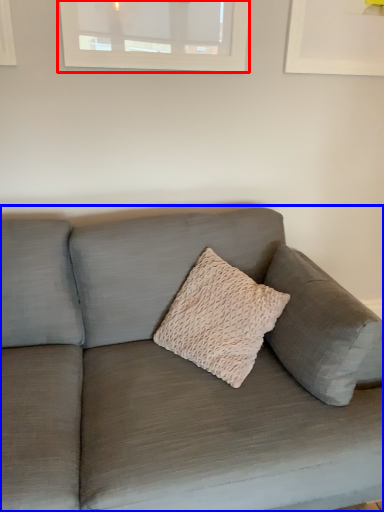
Question: Which of the following is the farthest to the observer, window (highlighted by a red box) or studio couch (highlighted by a blue box)?

Choices:
 (A) window
 (B) studio couch

Answer: (A)